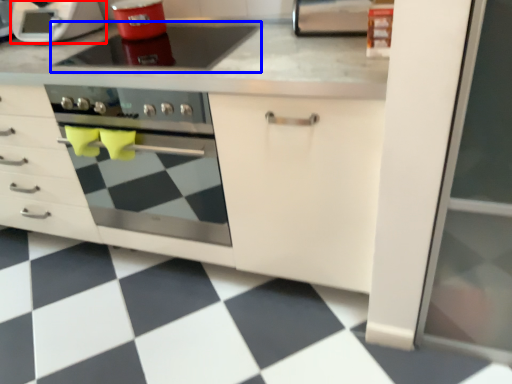
Question: Which of the following is the farthest to the observer, home appliance (highlighted by a red box) or gas stove (highlighted by a blue box)?

Choices:
 (A) home appliance
 (B) gas stove

Answer: (A)